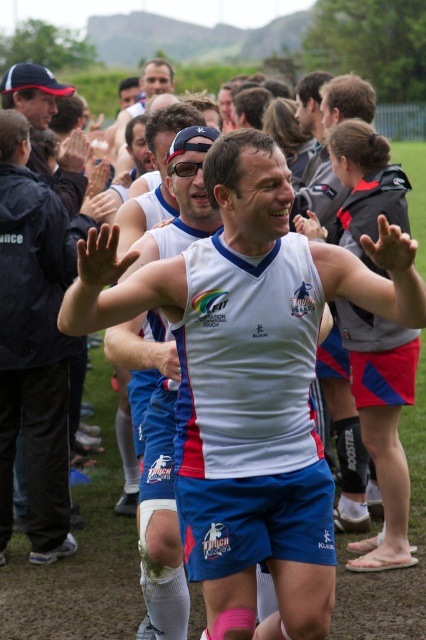
Does point (345, 262) come closer to viewer compared to point (16, 358)?

Yes, point (345, 262) is closer to viewer.

Find the location of `white jersey at center`. white jersey at center is located at coordinates (120, 285).